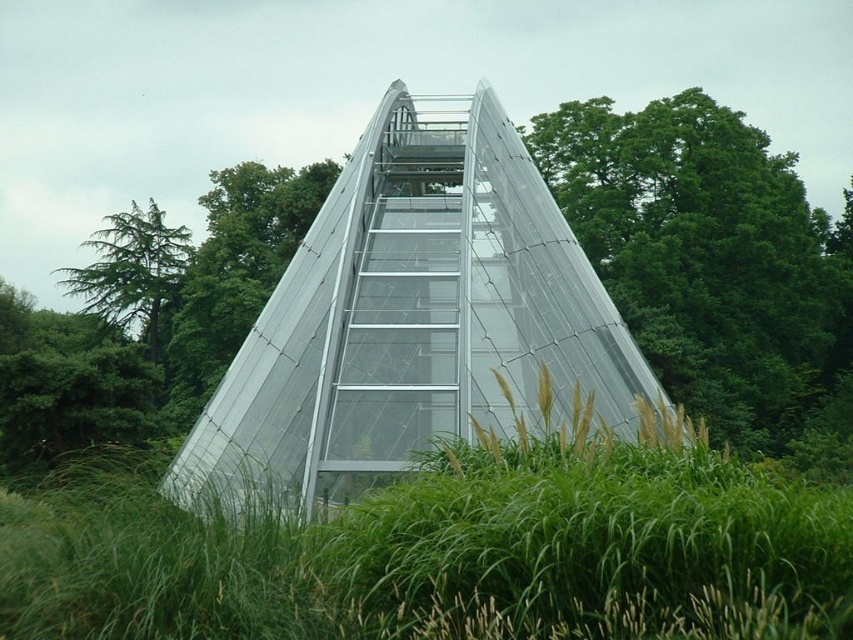
Can you confirm if green grass at center is positioned to the left of green leafy tree at center?

Incorrect, green grass at center is not on the left side of green leafy tree at center.

Between green grass at center and green leafy tree at center, which one appears on the left side from the viewer's perspective?

green leafy tree at center

Measure the distance between point [32,608] and camera.

They are 142.89 feet apart.

Find the location of a particular element. This screenshot has height=640, width=853. green grass at center is located at coordinates (447, 550).

Which is more to the right, transparent glass pyramid at center or green leafy tree at upper right?

green leafy tree at upper right

Does transparent glass pyramid at center come in front of green leafy tree at upper right?

Yes, transparent glass pyramid at center is closer to the viewer.

This screenshot has width=853, height=640. What are the coordinates of `transparent glass pyramid at center` in the screenshot? It's located at (413, 323).

Is point (383, 205) positioned after point (10, 410)?

That is True.

Is transparent glass pyramid at center wider than green leafy tree at left?

In fact, transparent glass pyramid at center might be narrower than green leafy tree at left.

The image size is (853, 640). What do you see at coordinates (413, 323) in the screenshot? I see `transparent glass pyramid at center` at bounding box center [413, 323].

At what (x,y) coordinates should I click in order to perform the action: click on transparent glass pyramid at center. Please return your answer as a coordinate pair (x, y). Image resolution: width=853 pixels, height=640 pixels. Looking at the image, I should click on (413, 323).